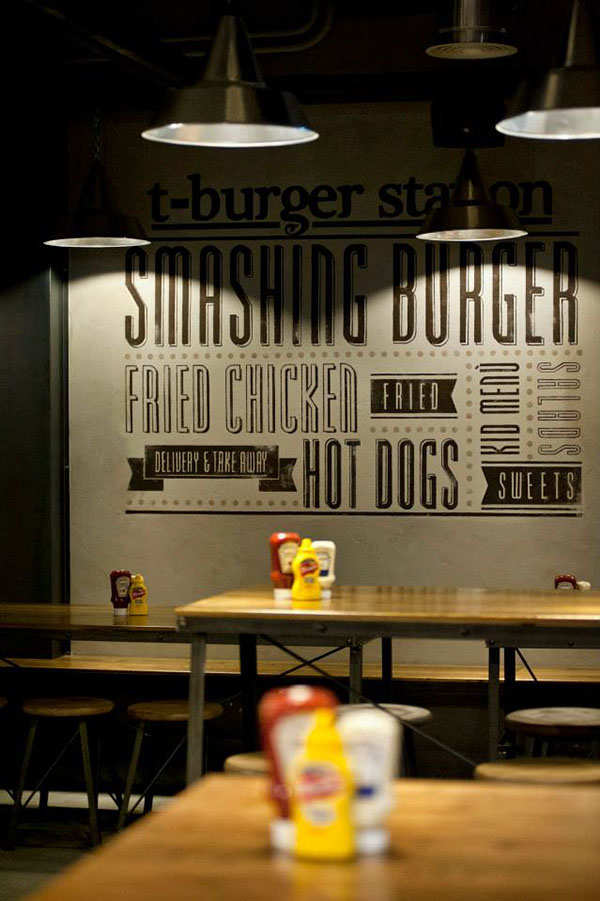
Identify the location of bench. This screenshot has height=901, width=600. (155, 662).